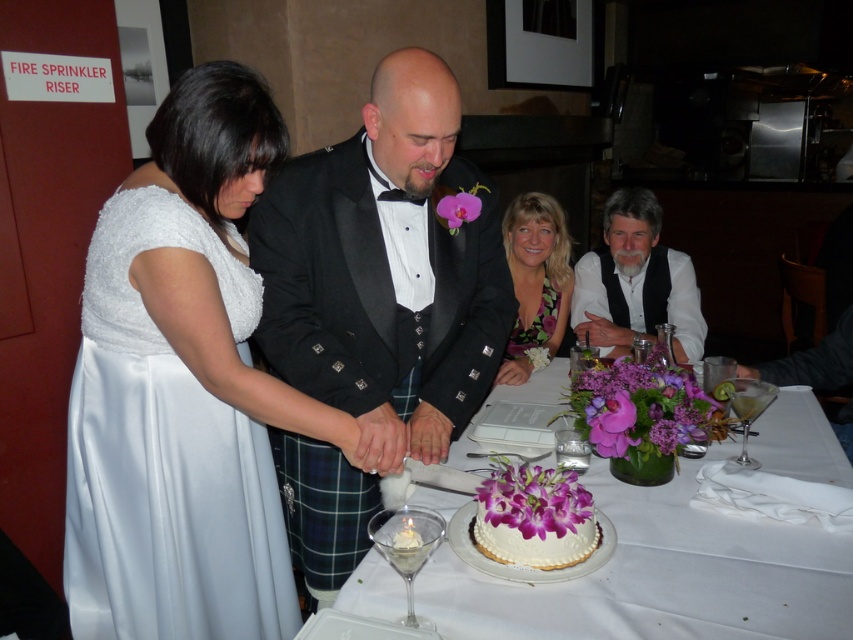
You are a photographer at the wedding and need to capture a photo of both the white frosted cake at center and the white textured cake at center. Which cake should you focus on first if you want to include both in your frame without moving the camera?

The white frosted cake at center is located below the white textured cake at center, so you should focus on the white textured cake at center first to ensure both are in the frame without moving the camera.